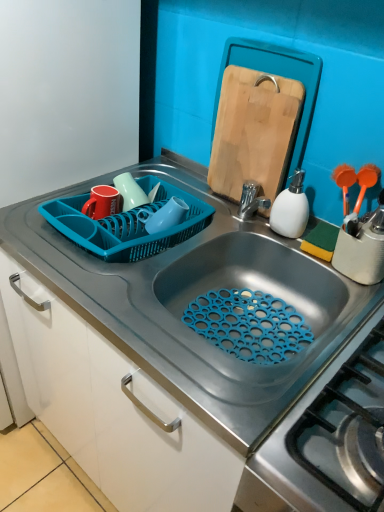
Where is `vacant space to the right of matte ceramic mugs at upper center, which appears as the first tableware when viewed from the right`? vacant space to the right of matte ceramic mugs at upper center, which appears as the first tableware when viewed from the right is located at coordinates (196, 216).